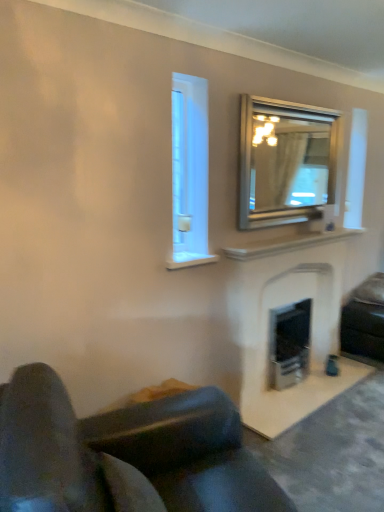
Question: Considering the relative positions of black leather studio couch at lower right, acting as the first studio couch starting from the right, and white stone fireplace at center in the image provided, is black leather studio couch at lower right, acting as the first studio couch starting from the right, to the right of white stone fireplace at center from the viewer's perspective?

Choices:
 (A) no
 (B) yes

Answer: (B)

Question: Is black leather studio couch at lower right, which is the 1th studio couch from back to front, facing away from white stone fireplace at center?

Choices:
 (A) yes
 (B) no

Answer: (B)

Question: From the image's perspective, is black leather studio couch at lower right, which is the 2th studio couch in front-to-back order, over white stone fireplace at center?

Choices:
 (A) yes
 (B) no

Answer: (B)

Question: Considering the relative sizes of black leather studio couch at lower right, which is the 1th studio couch from back to front, and white stone fireplace at center in the image provided, is black leather studio couch at lower right, which is the 1th studio couch from back to front, shorter than white stone fireplace at center?

Choices:
 (A) yes
 (B) no

Answer: (A)

Question: Is the depth of black leather studio couch at lower right, which is the 1th studio couch from back to front, greater than that of white stone fireplace at center?

Choices:
 (A) no
 (B) yes

Answer: (B)

Question: From their relative heights in the image, would you say silver metallic mirror at upper right is taller or shorter than white marble fireplace at upper center?

Choices:
 (A) tall
 (B) short

Answer: (A)

Question: Is silver metallic mirror at upper right bigger or smaller than white marble fireplace at upper center?

Choices:
 (A) small
 (B) big

Answer: (B)

Question: Considering the positions of silver metallic mirror at upper right and white marble fireplace at upper center in the image, is silver metallic mirror at upper right wider or thinner than white marble fireplace at upper center?

Choices:
 (A) wide
 (B) thin

Answer: (B)

Question: Considering the relative positions of silver metallic mirror at upper right and white marble fireplace at upper center in the image provided, is silver metallic mirror at upper right to the left or to the right of white marble fireplace at upper center?

Choices:
 (A) left
 (B) right

Answer: (A)

Question: From a real-world perspective, is leather couch at lower left, marked as the 2th studio couch in a right-to-left arrangement, physically located above or below black leather studio couch at lower right, which is the 2th studio couch in front-to-back order?

Choices:
 (A) above
 (B) below

Answer: (A)

Question: Considering the positions of leather couch at lower left, positioned as the second studio couch in back-to-front order, and black leather studio couch at lower right, which is the 2th studio couch in front-to-back order, in the image, is leather couch at lower left, positioned as the second studio couch in back-to-front order, taller or shorter than black leather studio couch at lower right, which is the 2th studio couch in front-to-back order,?

Choices:
 (A) short
 (B) tall

Answer: (B)

Question: Based on their positions, is leather couch at lower left, the 1th studio couch when ordered from front to back, located to the left or right of black leather studio couch at lower right, which is the 2th studio couch in front-to-back order?

Choices:
 (A) right
 (B) left

Answer: (B)

Question: Does point (76, 429) appear closer or farther from the camera than point (379, 293)?

Choices:
 (A) closer
 (B) farther

Answer: (A)

Question: Relative to leather couch at lower left, marked as the 2th studio couch in a right-to-left arrangement, is black leather studio couch at lower right, which is the 1th studio couch from back to front, in front or behind?

Choices:
 (A) front
 (B) behind

Answer: (B)

Question: From a real-world perspective, is black leather studio couch at lower right, which is the 1th studio couch from back to front, positioned above or below leather couch at lower left, the 1th studio couch when ordered from front to back?

Choices:
 (A) below
 (B) above

Answer: (A)